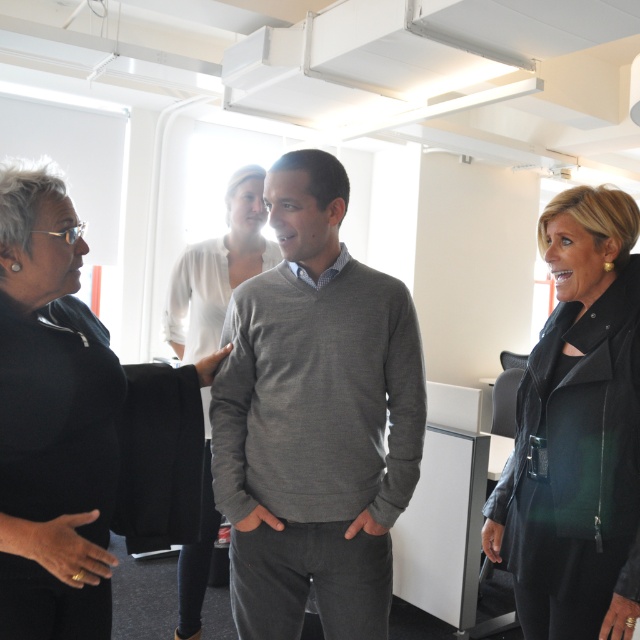
You are standing in the room and want to hand a document to the person wearing the white silk blouse at center without approaching the black leather jacket at right. Is there a clear path to reach them?

The black leather jacket at right is closer to the viewer than the white silk blouse at center, so you can approach the white silk blouse at center without going near the black leather jacket at right by moving around them.

You are an interior designer observing the scene. You need to place a decorative shelf between the gray sweater at center and the white silk blouse at center. Which object should the shelf be placed closer to if the shelf must be closer to the smaller one?

The gray sweater at center is smaller than the white silk blouse at center, so the shelf should be placed closer to the gray sweater at center.